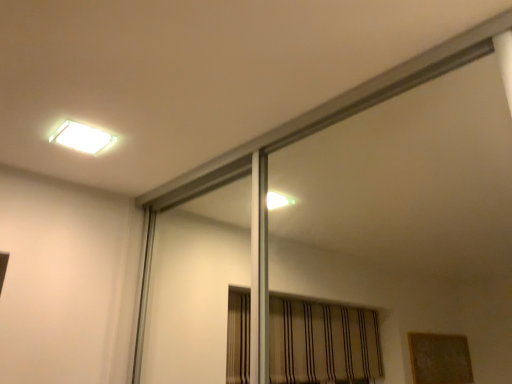
Identify the location of white glossy rectangular light at upper left. (82, 137).

The width and height of the screenshot is (512, 384). What do you see at coordinates (82, 137) in the screenshot?
I see `white glossy rectangular light at upper left` at bounding box center [82, 137].

Locate an element on the screen. white glossy rectangular light at upper left is located at coordinates (82, 137).